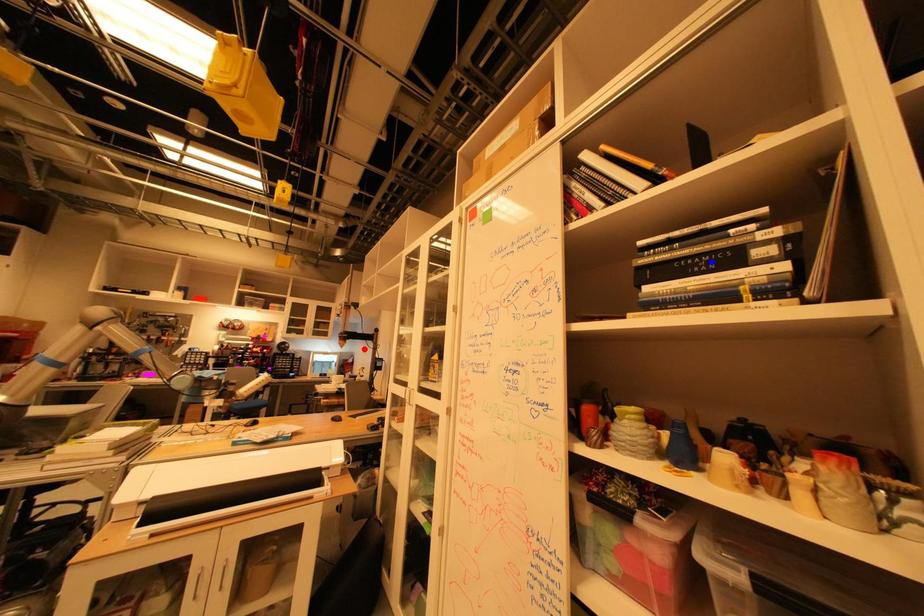
Question: In the image, two points are highlighted. Which point is nearer to the camera? Reply with the corresponding letter.

Choices:
 (A) blue point
 (B) red point

Answer: (A)